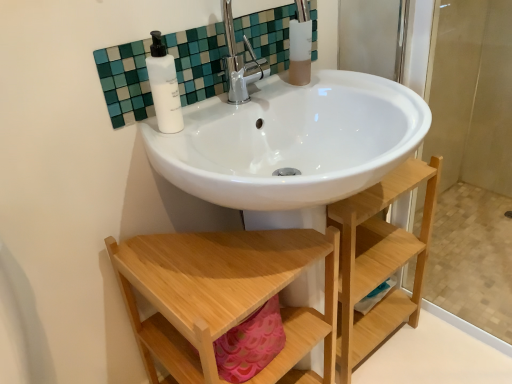
The height and width of the screenshot is (384, 512). Find the location of `free space in front of translucent frosted glass cup at upper center`. free space in front of translucent frosted glass cup at upper center is located at coordinates (308, 90).